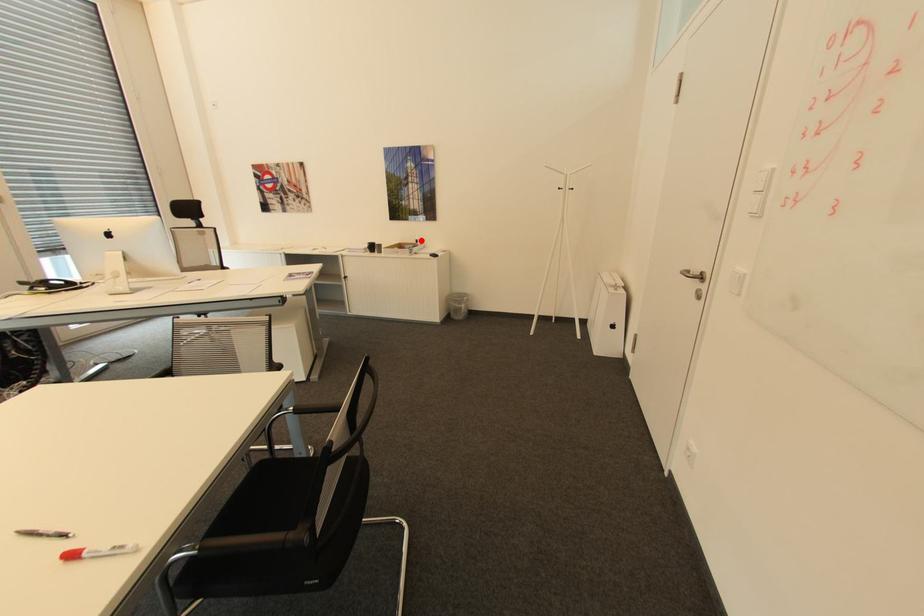
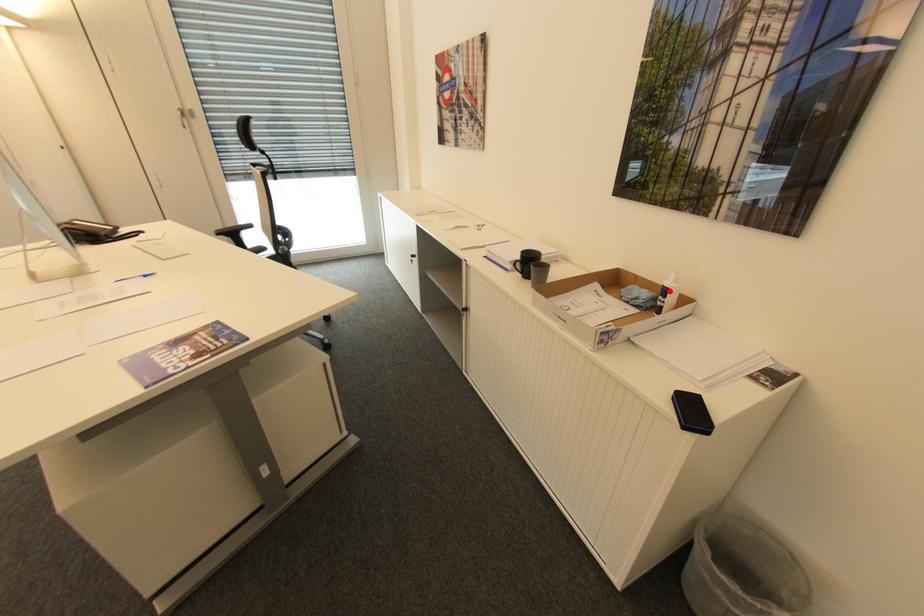
I am providing you with two images of the same scene from different viewpoints. A red point is marked on the first image and another point is marked on the second image. Are the points marked in image1 and image2 representing the same 3D position?

Yes